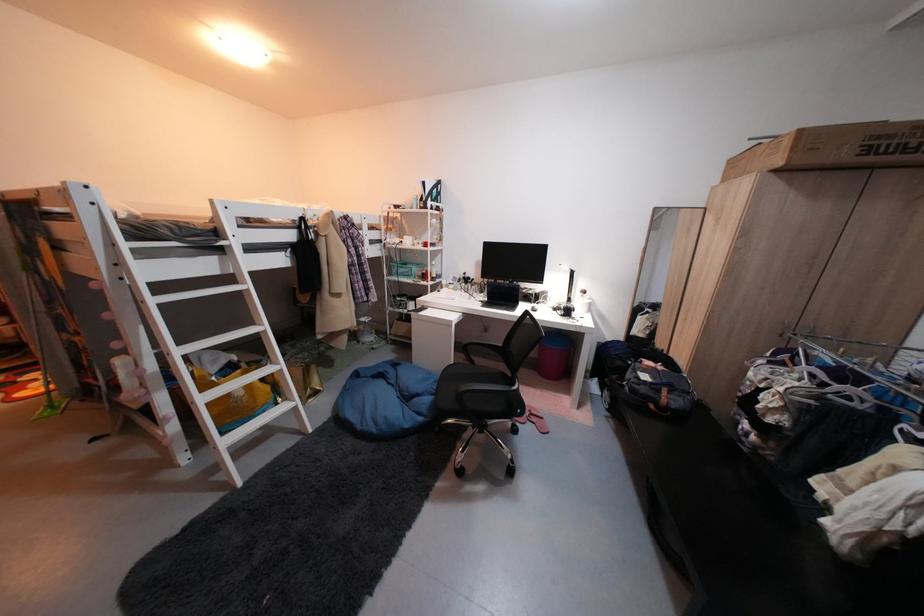
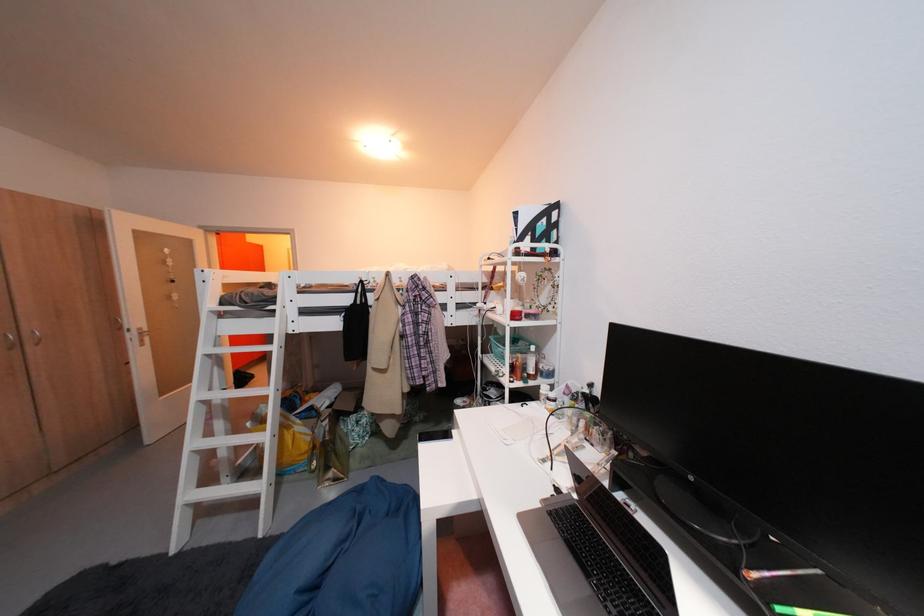
Locate, in the second image, the point that corresponds to (271,403) in the first image.

(296, 461)